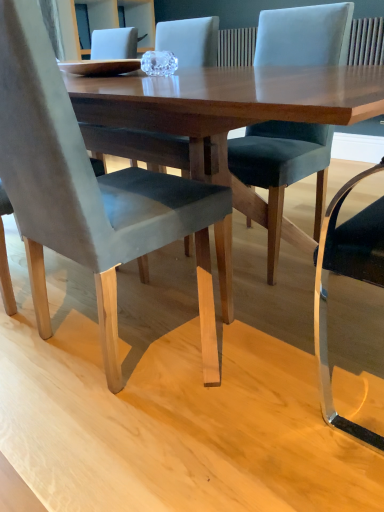
Locate an element on the screen. space that is in front of velvet dark gray chair at center, the second chair viewed from the left is located at coordinates (284, 297).